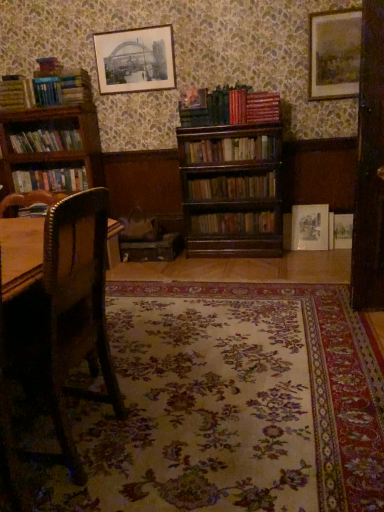
The height and width of the screenshot is (512, 384). In order to click on free point above floral carpet at center (from a real-world perspective) in this screenshot , I will do `click(228, 389)`.